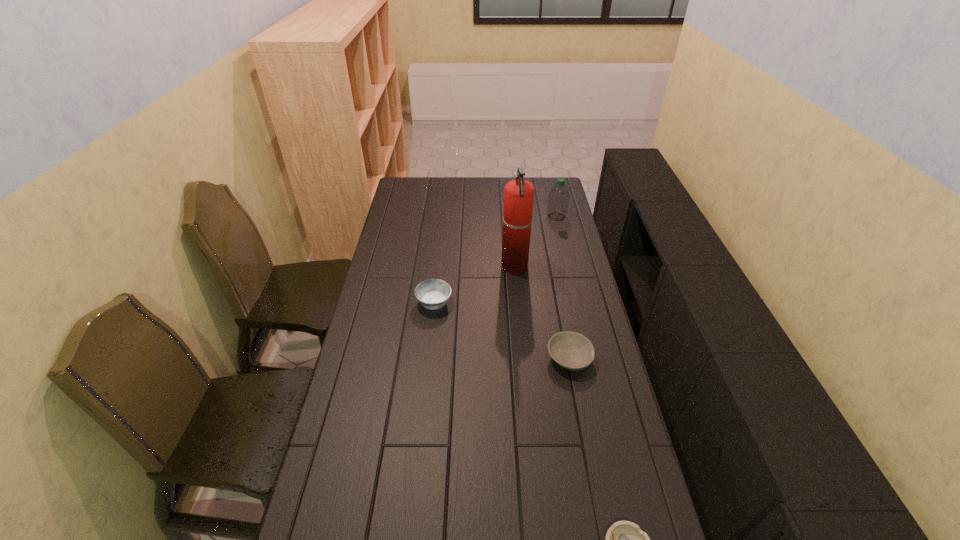
Find the location of `vacant space that is in between the second object from left to right and the fourth tallest object`. vacant space that is in between the second object from left to right and the fourth tallest object is located at coordinates (542, 313).

Find the location of a particular element. vacant area between the farther ashtray and the fourth object from right to left is located at coordinates (474, 285).

This screenshot has height=540, width=960. I want to click on free space between the left ashtray and the fourth shortest object, so click(495, 260).

This screenshot has width=960, height=540. I want to click on free spot between the tallest object and the third farthest object, so click(474, 285).

Image resolution: width=960 pixels, height=540 pixels. Find the location of `unoccupied area between the fire extinguisher and the fourth farthest object`. unoccupied area between the fire extinguisher and the fourth farthest object is located at coordinates (542, 313).

The image size is (960, 540). What are the coordinates of `vacant region between the second shortest object and the water bottle` in the screenshot? It's located at (563, 287).

Identify the location of free space between the third nearest object and the fire extinguisher. This screenshot has width=960, height=540. 474,285.

Where is `free space between the second object from left to right and the left ashtray`? free space between the second object from left to right and the left ashtray is located at coordinates (474, 285).

You are a GUI agent. You are given a task and a screenshot of the screen. Output one action in this format:
    pyautogui.click(x=<x>, y=<y>)
    Task: Click on the closest object to the left ashtray
    
    Given the screenshot: What is the action you would take?
    pyautogui.click(x=518, y=194)

This screenshot has width=960, height=540. In order to click on object identified as the fourth closest to the third tallest object in this screenshot , I will do `click(624, 539)`.